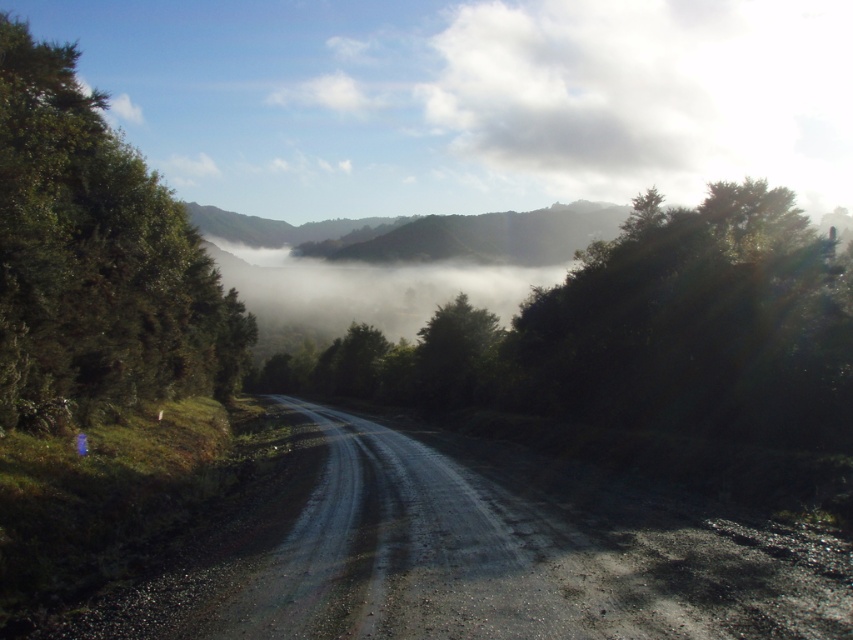
You are a hiker planning to take a photo of the green leafy tree at left and the green matte tree at center. Which tree should you move closer to if you want both trees to appear equally sized in your photo?

You should move closer to the green leafy tree at left since it is larger in size than the green matte tree at center. By moving closer to the larger tree, you can reduce its apparent size in the photo, balancing it with the smaller green matte tree at center.